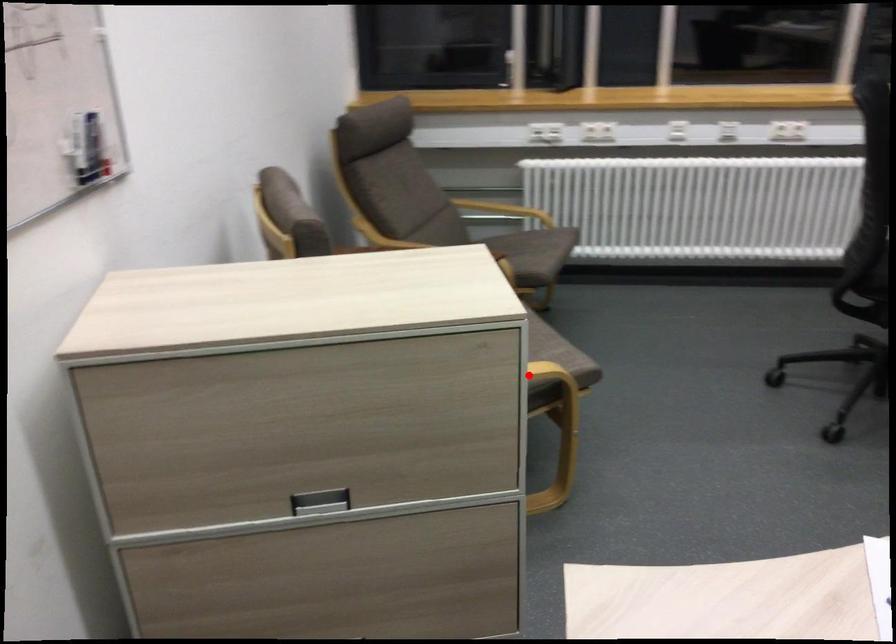
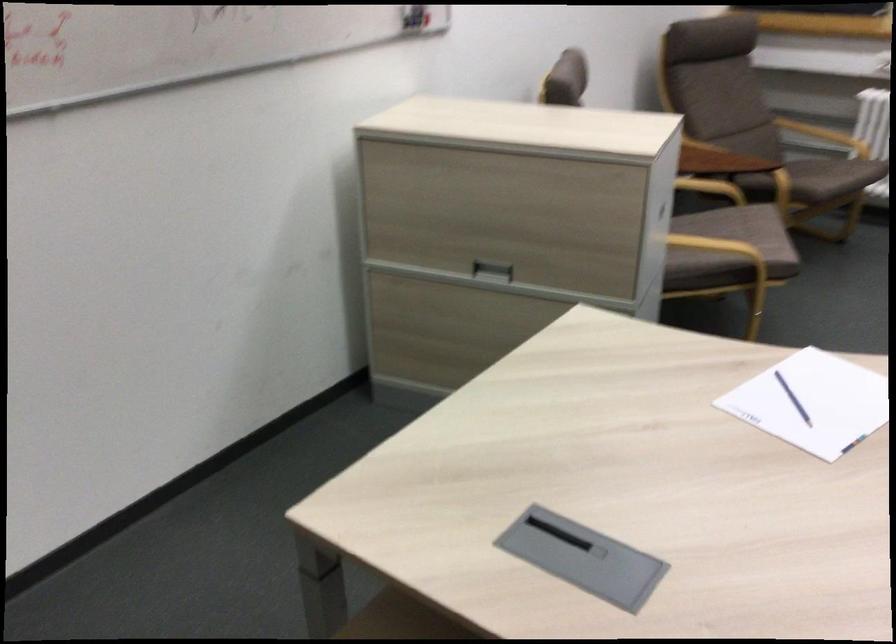
Question: A red point is marked in image1. In image2, is the corresponding 3D point closer to the camera or farther? Reply with the corresponding letter.

Choices:
 (A) The corresponding 3D point is closer.
 (B) The corresponding 3D point is farther.

Answer: (B)